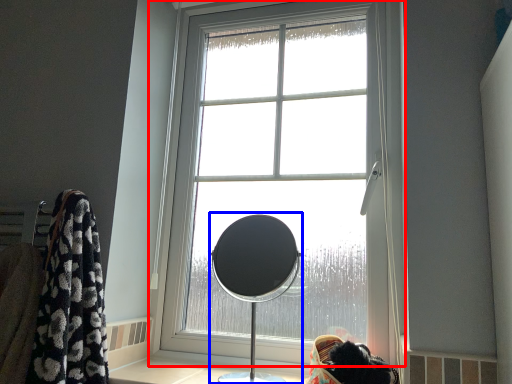
Question: Which point is further to the camera, window (highlighted by a red box) or table lamp (highlighted by a blue box)?

Choices:
 (A) window
 (B) table lamp

Answer: (A)